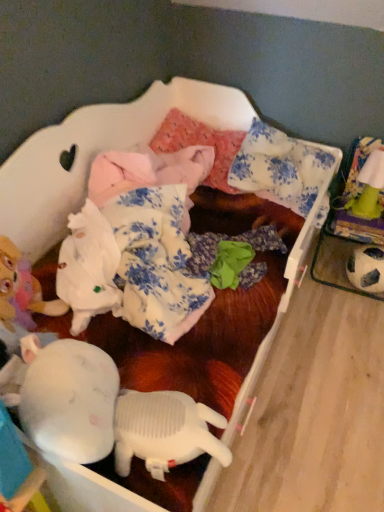
Identify the location of free space in front of black and white textured soccer ball at right, which ranks as the 1th toy in bottom-to-top order. point(362,314).